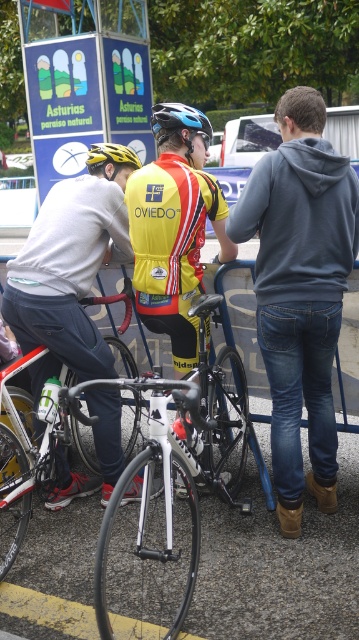
Question: Is the position of white glossy bicycle at center less distant than that of yellow matte bicycle helmet at center?

Choices:
 (A) yes
 (B) no

Answer: (A)

Question: Is white metallic bicycle at center closer to the viewer compared to matte blue bicycle helmet at center?

Choices:
 (A) no
 (B) yes

Answer: (B)

Question: Based on their relative distances, which object is farther from the white glossy bicycle at center?

Choices:
 (A) denim jeans at center
 (B) yellow fabric safety vest at center
 (C) yellow/red jersey at center

Answer: (C)

Question: Among these objects, which one is nearest to the camera?

Choices:
 (A) white metallic bicycle at center
 (B) yellow fabric safety vest at center
 (C) yellow/red jersey at center

Answer: (A)

Question: Which point is closer to the camera taking this photo?

Choices:
 (A) (268, 268)
 (B) (197, 422)

Answer: (B)

Question: In this image, where is white glossy bicycle at center located relative to white metallic bicycle at center?

Choices:
 (A) above
 (B) below

Answer: (A)